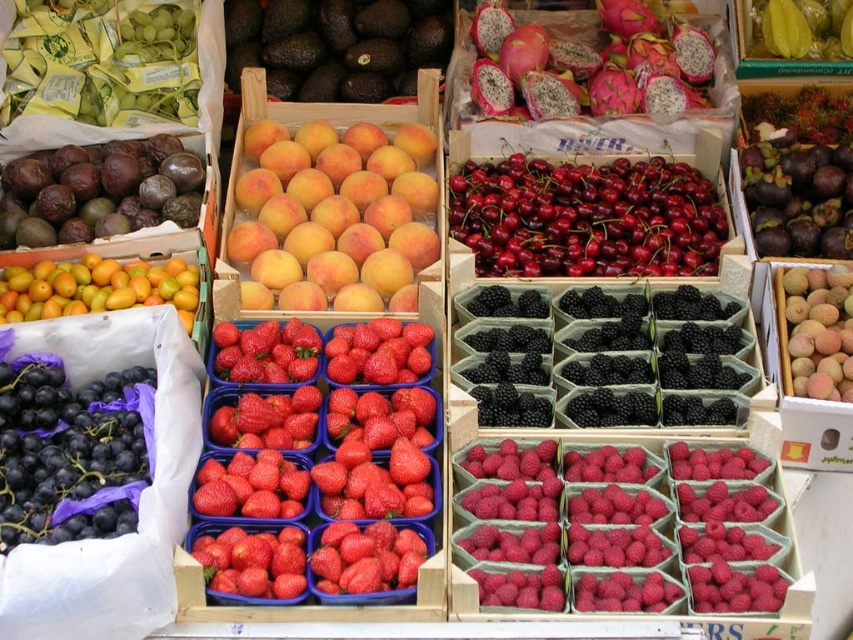
Is point (50, 429) closer to camera compared to point (265, 17)?

Yes, point (50, 429) is closer to viewer.

Can you confirm if black matte grapes at lower left is smaller than shiny dark green avocado at center?

Yes, black matte grapes at lower left is smaller than shiny dark green avocado at center.

Looking at this image, who is more distant from viewer, (73,448) or (303,29)?

Positioned behind is point (303,29).

Find the location of `black matte grapes at lower left`. black matte grapes at lower left is located at coordinates (71, 451).

Between shiny dark green avocado at center and purple matte mangosteen at center-right, which one appears on the right side from the viewer's perspective?

purple matte mangosteen at center-right is more to the right.

Is point (268, 77) farther from viewer compared to point (802, 154)?

That is True.

Is point (397, 49) behind point (798, 198)?

Yes, it is behind point (798, 198).

Locate an element on the screen. The height and width of the screenshot is (640, 853). shiny dark green avocado at center is located at coordinates (335, 45).

In the scene shown: How distant is shiny dark green avocado at center from smooth brown mangoes at center right?

They are 6.95 feet apart.

At what (x,y) coordinates should I click in order to perform the action: click on shiny dark green avocado at center. Please return your answer as a coordinate pair (x, y). Looking at the image, I should click on (335, 45).